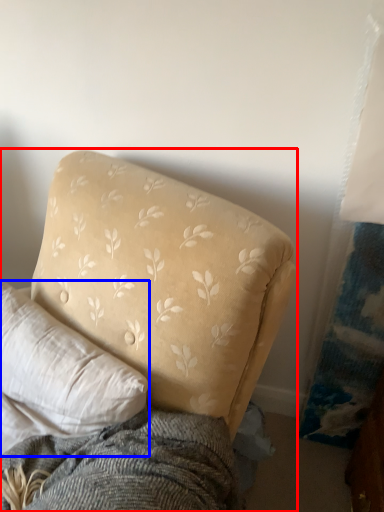
Question: Which of the following is the closest to the observer, studio couch (highlighted by a red box) or pillow (highlighted by a blue box)?

Choices:
 (A) studio couch
 (B) pillow

Answer: (A)